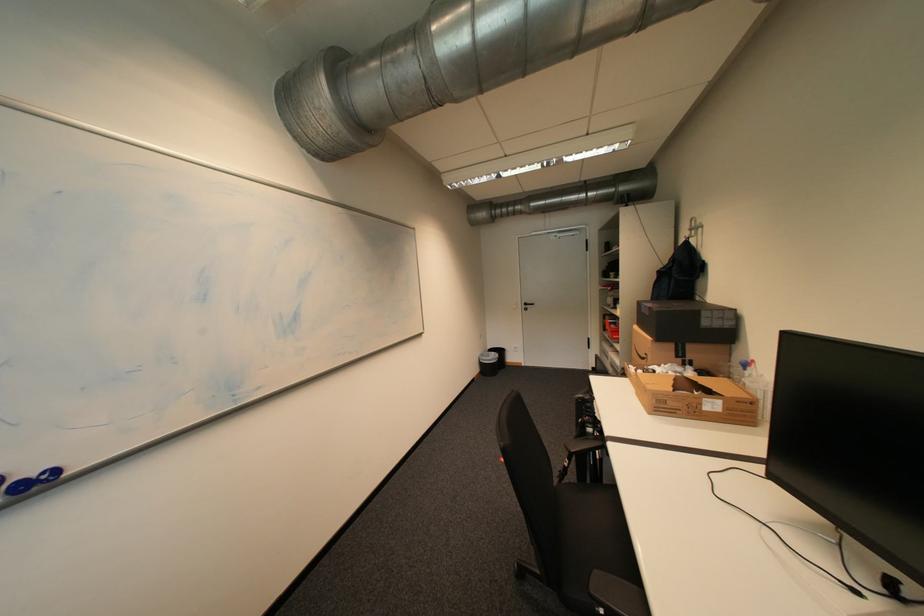
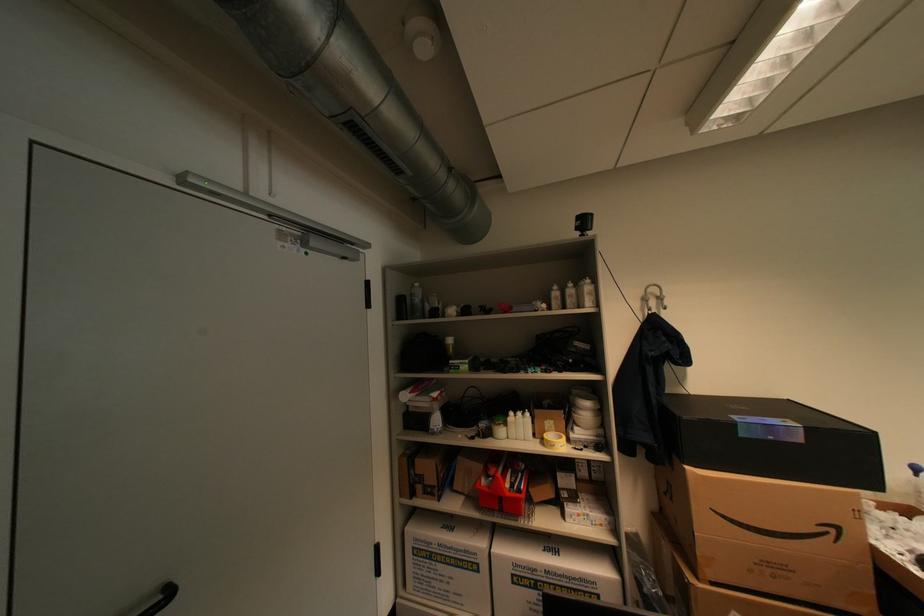
Locate, in the second image, the point that corresponds to (541,305) in the first image.

(176, 594)